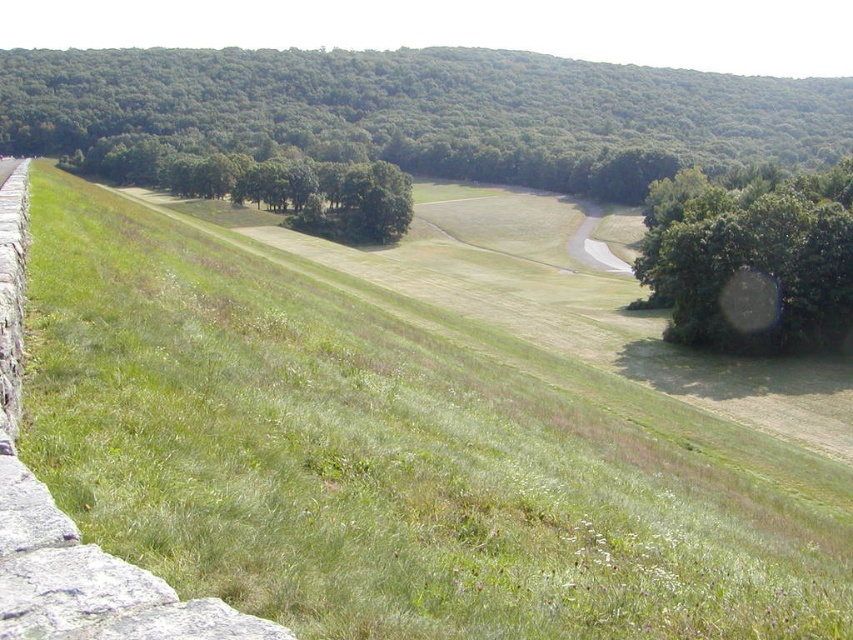
You are a hiker trying to determine the best route to avoid obstacles. Given the green grassy slope at left and the green leafy tree at center right, which object is shorter and thus easier to navigate around?

The green grassy slope at left is shorter than the green leafy tree at center right, so it would be easier to navigate around the green grassy slope at left.

You are standing on the green grassy slope at left and want to walk to the green leafy tree at center. Which direction should you walk to get closer to the tree?

Since the green grassy slope at left is closer to the viewer than the green leafy tree at center, you should walk forward towards the tree to get closer to the green leafy tree at center.